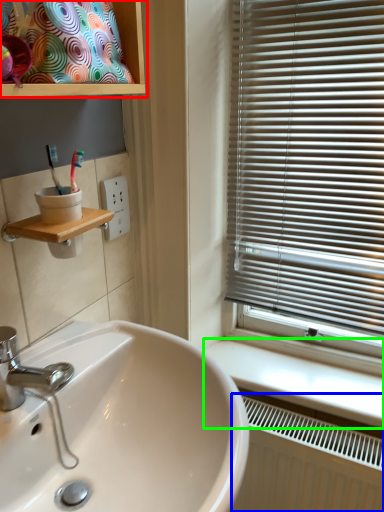
Question: Considering the real-world distances, which object is closest to cabinet (highlighted by a red box)? radiator (highlighted by a blue box) or counter top (highlighted by a green box).

Choices:
 (A) radiator
 (B) counter top

Answer: (B)